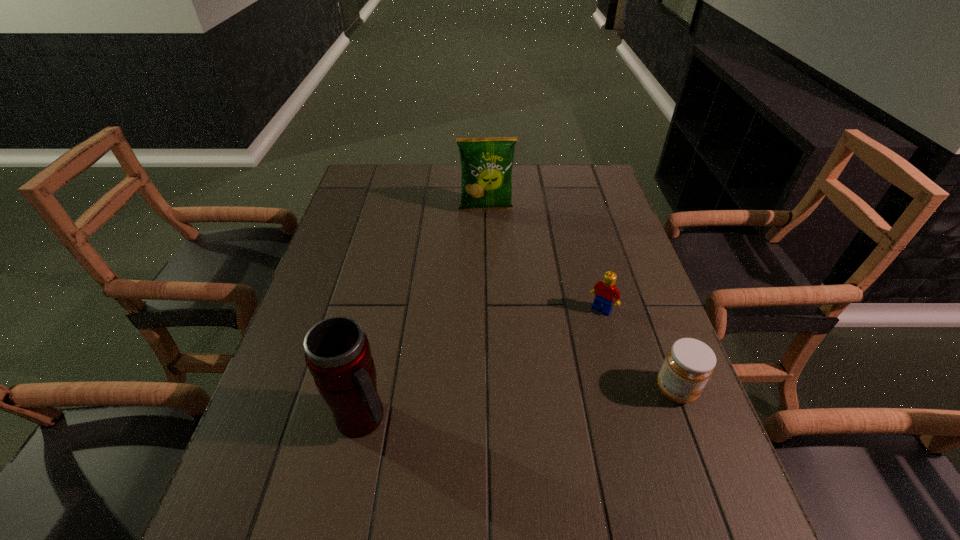
Locate an element on the screen. empty space that is in between the jam and the Lego is located at coordinates (638, 350).

The width and height of the screenshot is (960, 540). Find the location of `free spot between the farthest object and the jam`. free spot between the farthest object and the jam is located at coordinates (581, 300).

This screenshot has height=540, width=960. I want to click on free point between the jam and the leftmost object, so click(519, 404).

Identify the location of object that is the second closest to the crisp (potato chip). This screenshot has width=960, height=540. (689, 363).

Select which object is the closest to the crisp (potato chip). Please provide its 2D coordinates. Your answer should be formatted as a tuple, i.e. [(x, y)], where the tuple contains the x and y coordinates of a point satisfying the conditions above.

[(606, 292)]

Find the location of a particular element. This screenshot has height=540, width=960. vacant point that satisfies the following two spatial constraints: 1. on the front side of the farthest object; 2. on the front label of the rightmost object is located at coordinates (489, 390).

This screenshot has width=960, height=540. In order to click on free space that satisfies the following two spatial constraints: 1. on the front side of the Lego; 2. on the front label of the jam in this screenshot , I will do `click(624, 390)`.